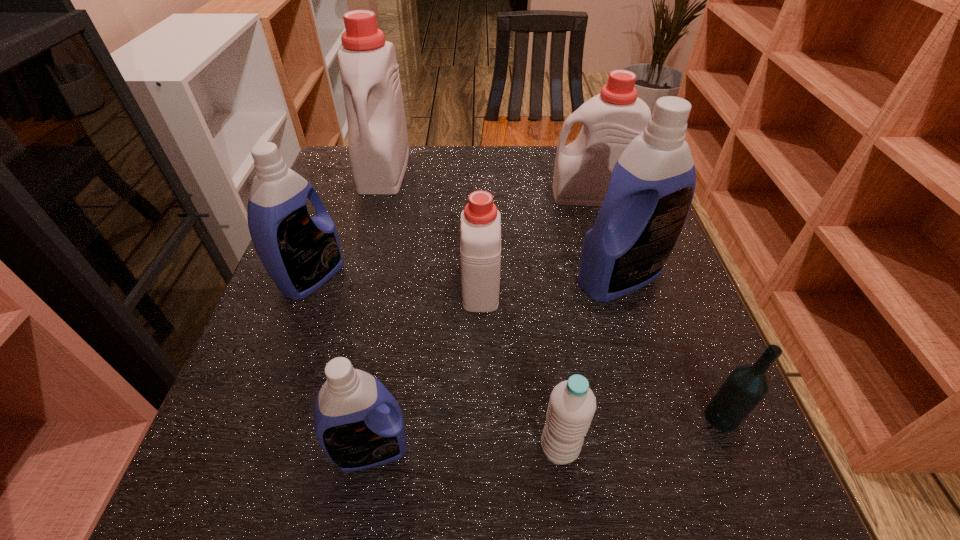
This screenshot has width=960, height=540. I want to click on free space between the fifth object from right to left and the rightmost white detergent, so click(x=536, y=240).

The width and height of the screenshot is (960, 540). Find the location of `empty space between the black vodka and the fifth object from left to right`. empty space between the black vodka and the fifth object from left to right is located at coordinates (640, 433).

Choose which object is the seventh nearest neighbor to the water bottle. Please provide its 2D coordinates. Your answer should be formatted as a tuple, i.e. [(x, y)], where the tuple contains the x and y coordinates of a point satisfying the conditions above.

[(377, 132)]

Locate an element on the screen. object that is the third closest to the smallest white detergent is located at coordinates (572, 404).

Find the location of a particular element. The image size is (960, 540). detergent object that ranks as the sixth closest to the black vodka is located at coordinates (377, 132).

Where is `detergent that is the fourth closest to the biggest blue detergent`? Image resolution: width=960 pixels, height=540 pixels. detergent that is the fourth closest to the biggest blue detergent is located at coordinates (377, 132).

Select which white detergent is the second closest to the third detergent from right to left. Please provide its 2D coordinates. Your answer should be formatted as a tuple, i.e. [(x, y)], where the tuple contains the x and y coordinates of a point satisfying the conditions above.

[(377, 132)]

Identify which white detergent is the closest to the fifth object from left to right. Please provide its 2D coordinates. Your answer should be formatted as a tuple, i.e. [(x, y)], where the tuple contains the x and y coordinates of a point satisfying the conditions above.

[(480, 231)]

Choose which blue detergent is the second nearest neighbor to the rightmost white detergent. Please provide its 2D coordinates. Your answer should be formatted as a tuple, i.e. [(x, y)], where the tuple contains the x and y coordinates of a point satisfying the conditions above.

[(300, 253)]

Select which blue detergent appears as the closest to the black vodka. Please provide its 2D coordinates. Your answer should be formatted as a tuple, i.e. [(x, y)], where the tuple contains the x and y coordinates of a point satisfying the conditions above.

[(652, 185)]